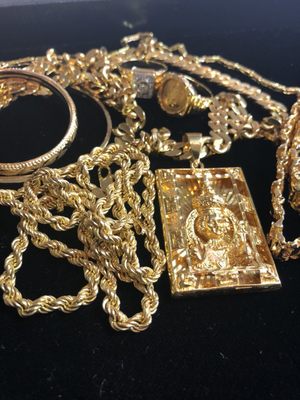
You are a GUI agent. You are given a task and a screenshot of the screen. Output one action in this format:
    pyautogui.click(x=<x>, y=<y>)
    Task: Click on the black table
    This screenshot has height=400, width=300.
    Given the screenshot: What is the action you would take?
    pyautogui.click(x=255, y=166)